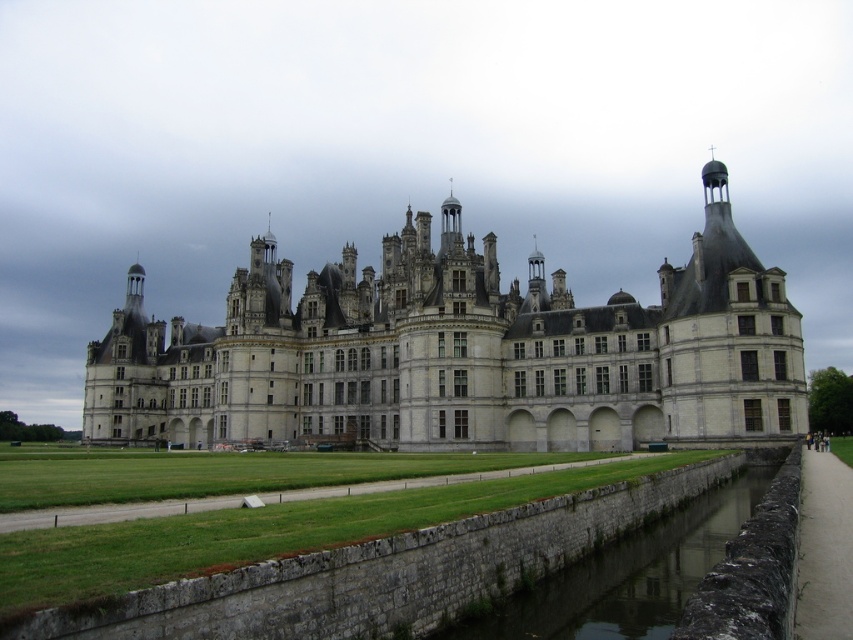
Is gray stone castle at center taller than gray stone wall at lower center?

Correct, gray stone castle at center is much taller as gray stone wall at lower center.

Who is more forward, (511, 392) or (764, 472)?

Point (764, 472) is more forward.

Is point (389, 442) positioned in front of point (715, 554)?

No, it is behind (715, 554).

Image resolution: width=853 pixels, height=640 pixels. Find the location of `gray stone castle at center`. gray stone castle at center is located at coordinates (461, 353).